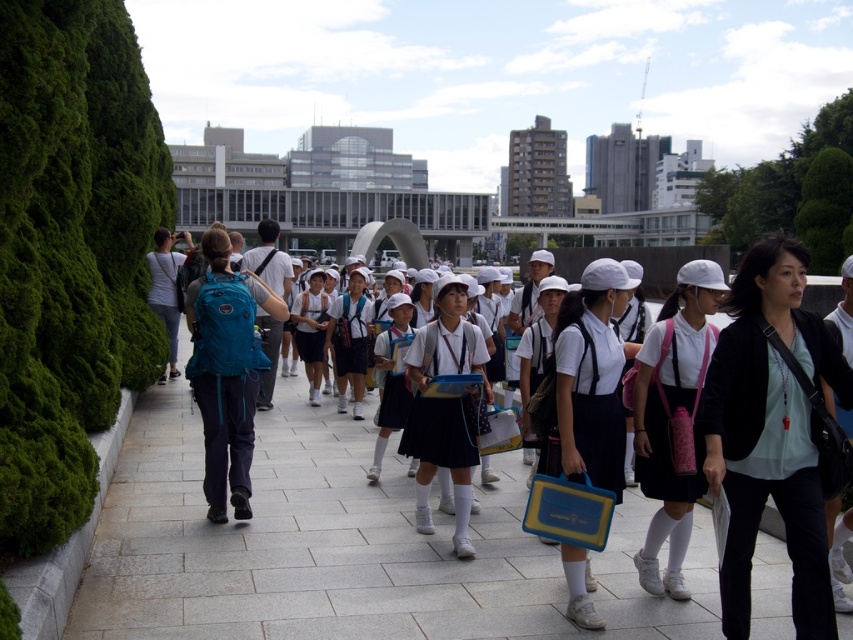
Question: Which of the following is the farthest from the observer?

Choices:
 (A) green leafy hedge at left
 (B) gray concrete pavement at center

Answer: (B)

Question: Which object is closer to the camera taking this photo?

Choices:
 (A) gray concrete pavement at center
 (B) teal fabric backpack at center-left

Answer: (A)

Question: Where is gray concrete pavement at center located in relation to teal fabric backpack at center-left in the image?

Choices:
 (A) above
 (B) below

Answer: (B)

Question: Does green leafy hedge at left have a greater width compared to black matte jacket at right?

Choices:
 (A) no
 (B) yes

Answer: (B)

Question: Estimate the real-world distances between objects in this image. Which object is closer to the gray concrete pavement at center?

Choices:
 (A) green leafy hedge at left
 (B) teal fabric backpack at center-left

Answer: (B)

Question: Is green leafy hedge at left positioned at the back of black matte jacket at right?

Choices:
 (A) no
 (B) yes

Answer: (A)